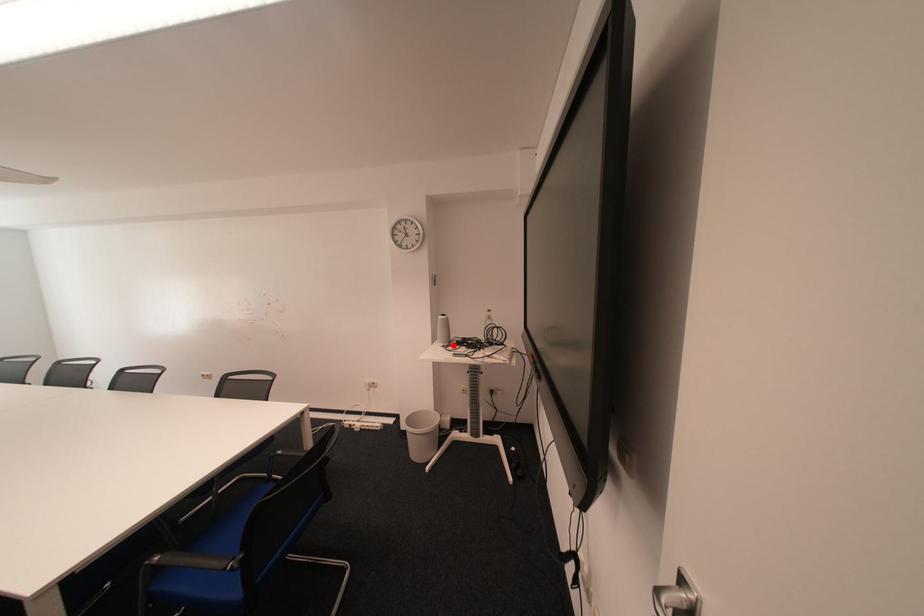
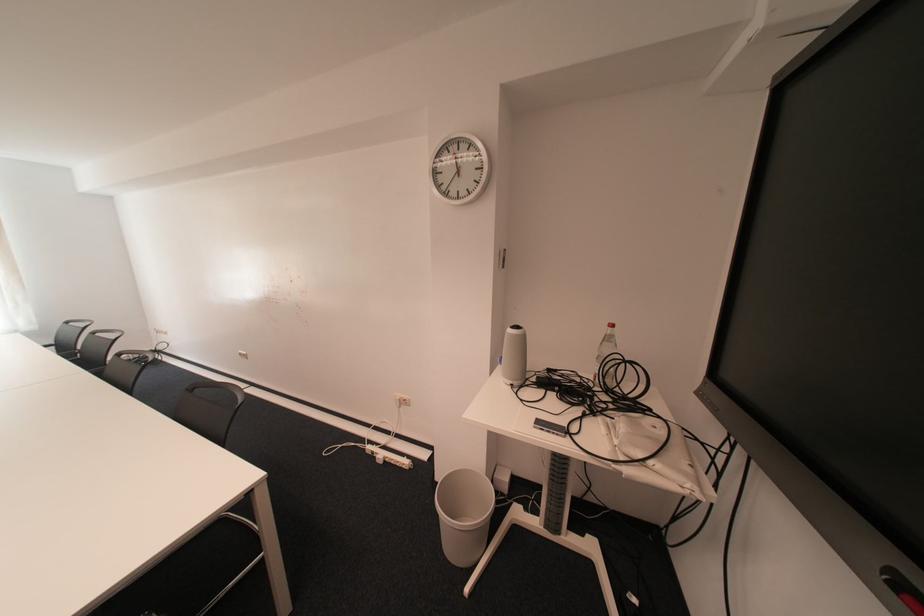
Where in the second image is the point corresponding to the highlighted location from the first image?

(520, 383)